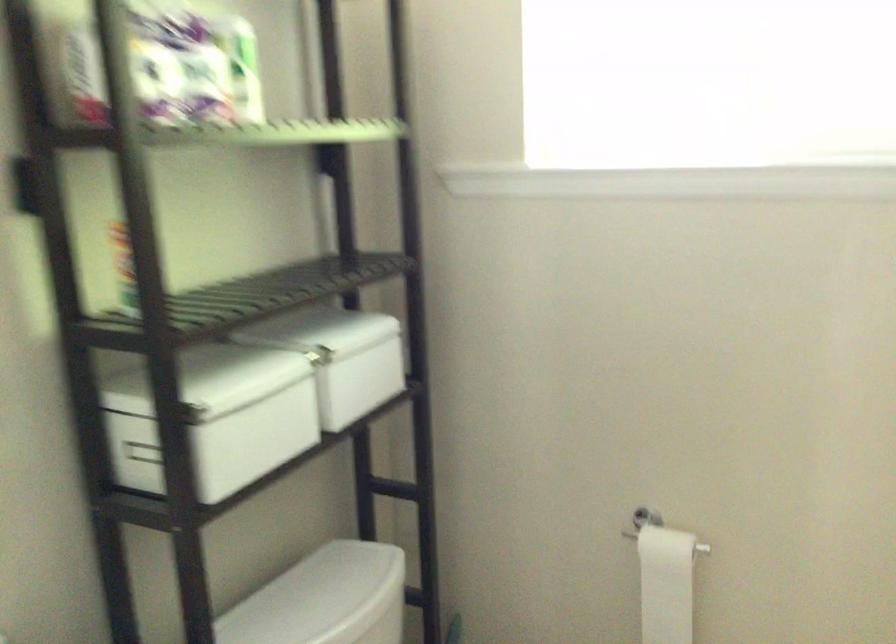
Question: The camera is either moving clockwise (left) or counter-clockwise (right) around the object. The first image is from the beginning of the video and the second image is from the end. Is the camera moving left or right when shooting the video?

Choices:
 (A) Left
 (B) Right

Answer: (B)